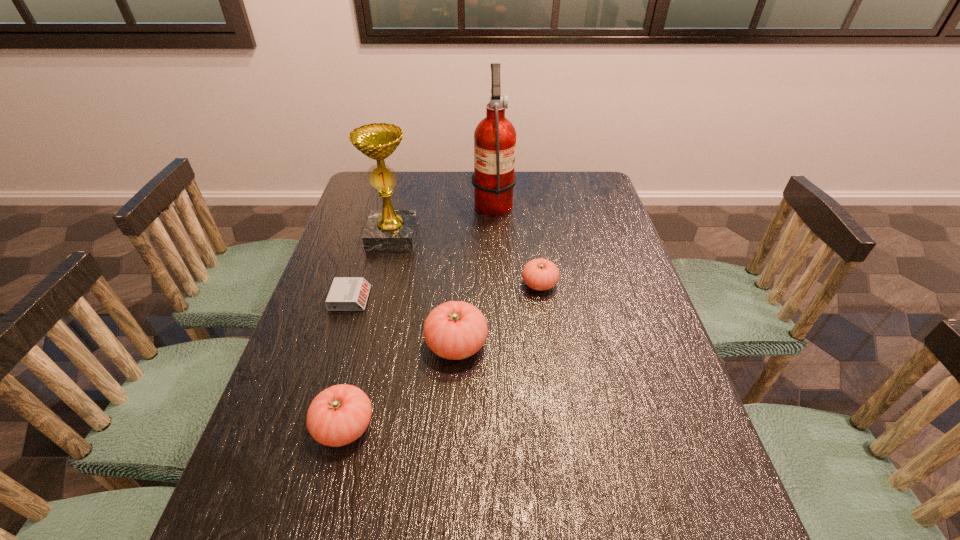
Please point out where to position a new tomato on the right to maintain spacing. Please provide its 2D coordinates. Your answer should be formatted as a tuple, i.e. [(x, y)], where the tuple contains the x and y coordinates of a point satisfying the conditions above.

[(604, 238)]